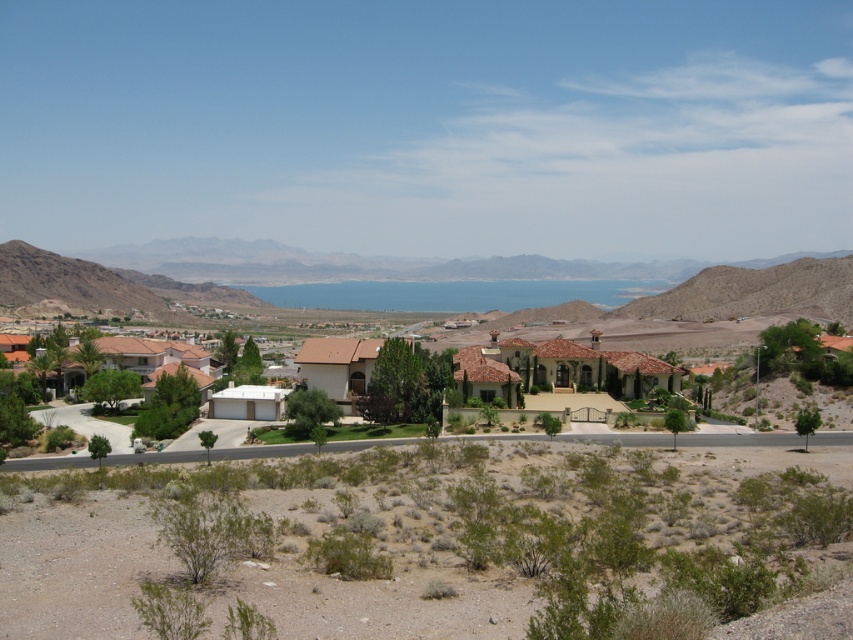
Question: Does desert sand at left have a larger size compared to brown tile roof houses at center?

Choices:
 (A) yes
 (B) no

Answer: (A)

Question: Which of these objects is positioned closest to the green shrubbery at lower center?

Choices:
 (A) desert sand at left
 (B) brown tile roof houses at center

Answer: (B)

Question: Where is green shrubbery at lower center located in relation to brown tile roof houses at center in the image?

Choices:
 (A) right
 (B) left

Answer: (B)

Question: Can you confirm if desert sand at left is thinner than brown tile roof houses at center?

Choices:
 (A) yes
 (B) no

Answer: (B)

Question: Which of these objects is positioned closest to the brown tile roof houses at center?

Choices:
 (A) desert sand at left
 (B) green shrubbery at lower center

Answer: (B)

Question: Which point is farther to the camera?

Choices:
 (A) (190, 468)
 (B) (27, 301)
 (C) (120, 337)

Answer: (B)